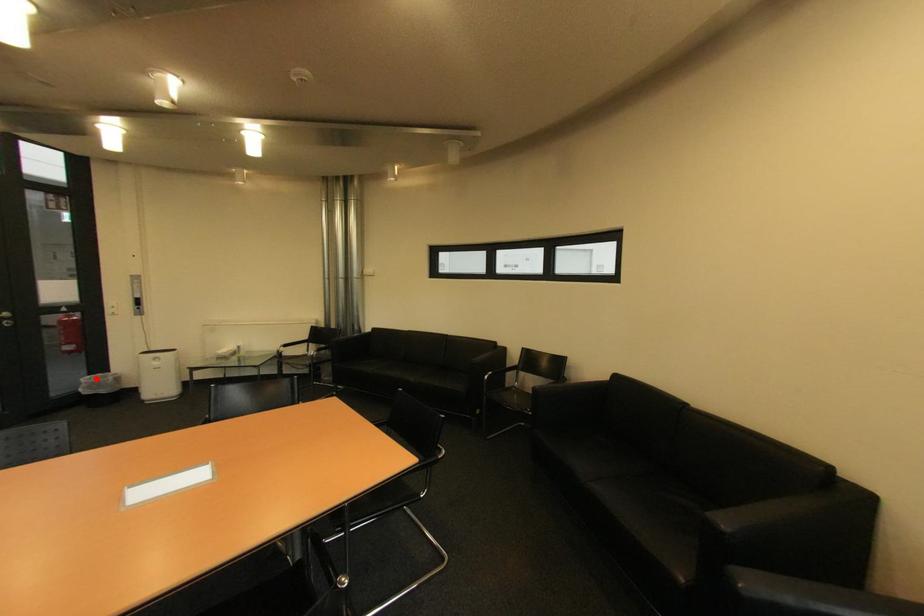
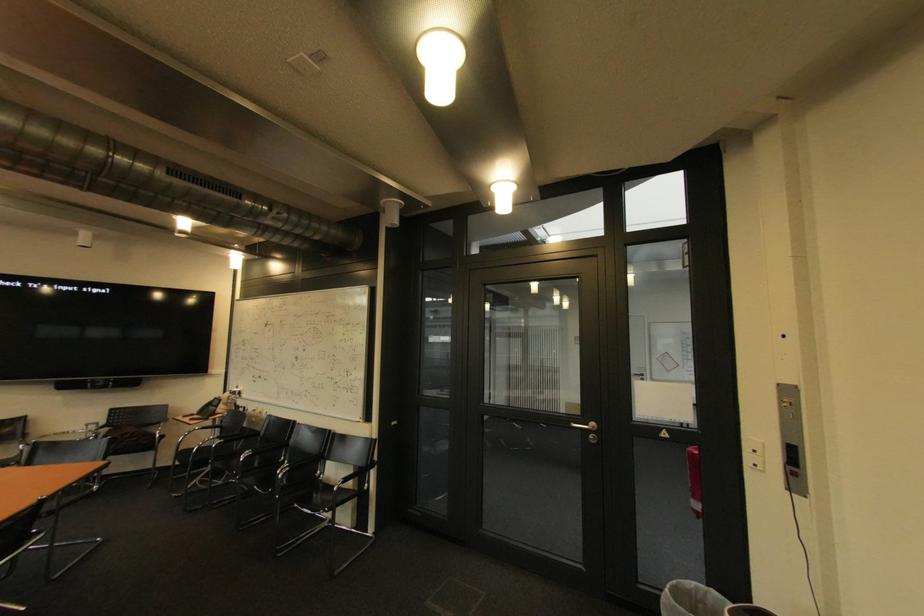
Question: I am providing you with two images of the same scene from different viewpoints. Given a red point in image1, look at the same physical point in image2. Is it:

Choices:
 (A) Closer to the viewpoint
 (B) Farther from the viewpoint

Answer: (B)